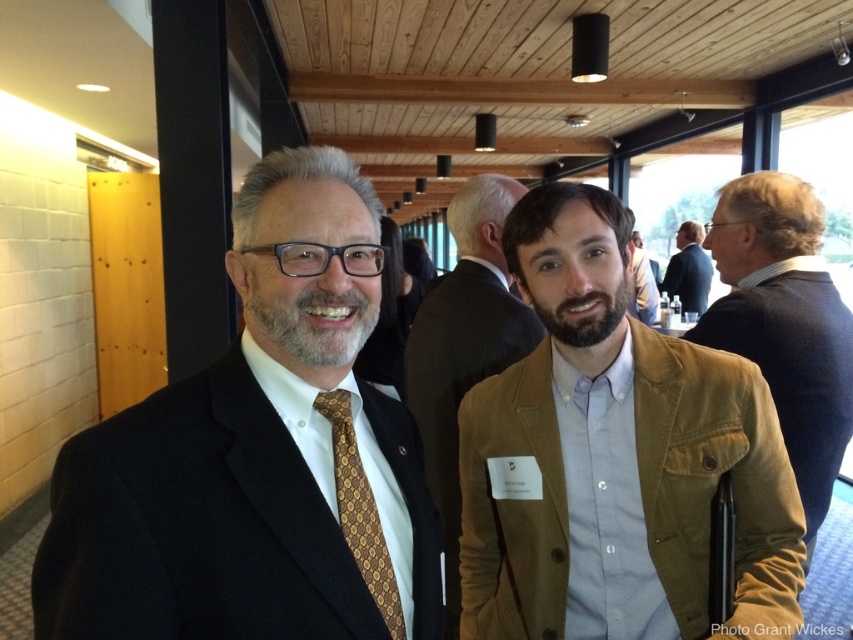
You are a photographer at this event and need to ensure that both the goldpatterned fabrictie at left and the dark blue suit at center are clearly visible in the photo. Based on their positions, which object is closer to the camera?

The goldpatterned fabrictie at left is in front of the dark blue suit at center, so it is closer to the camera.

You are a fashion designer observing the image. You need to determine which item has a narrower width between the goldpatterned fabrictie at left and the dark blue suit at center. Which one is it?

The goldpatterned fabrictie at left has a lesser width compared to the dark blue suit at center, so the goldpatterned fabrictie at left is narrower in width.

You are organizing a charity event and need to display two jackets on a mannequin. The brown leather jacket at right and the brown suede jacket at center are available. Which jacket should you choose if you want the one that takes up more space on the mannequin?

The brown suede jacket at center should be chosen because it occupies more space than the brown leather jacket at right.